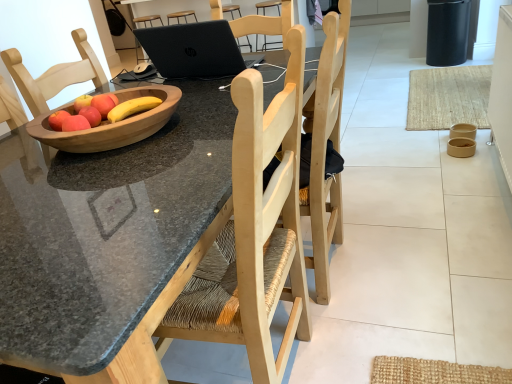
Question: From the image's perspective, is wooden bowl of fruit at center on wooden bowl at left, which is the first bowl in left-to-right order?

Choices:
 (A) no
 (B) yes

Answer: (B)

Question: Does wooden bowl of fruit at center have a greater height compared to wooden bowl at left, the 3th bowl from the back?

Choices:
 (A) no
 (B) yes

Answer: (A)

Question: From the image's perspective, does wooden bowl of fruit at center appear lower than wooden bowl at left, which is the first bowl in left-to-right order?

Choices:
 (A) yes
 (B) no

Answer: (B)

Question: Is the surface of wooden bowl of fruit at center in direct contact with wooden bowl at left, which is the third bowl from right to left?

Choices:
 (A) no
 (B) yes

Answer: (B)

Question: Is wooden bowl of fruit at center positioned in front of wooden bowl at left, which is the first bowl in left-to-right order?

Choices:
 (A) yes
 (B) no

Answer: (B)

Question: Considering the relative sizes of wooden bowl of fruit at center and wooden bowl at left, which is the third bowl from right to left, in the image provided, is wooden bowl of fruit at center smaller than wooden bowl at left, which is the third bowl from right to left,?

Choices:
 (A) yes
 (B) no

Answer: (A)

Question: Would you say wooden bowl at left, which is the first bowl in left-to-right order, is outside matte wood apple at center, which is the second apple in top-to-bottom order?

Choices:
 (A) no
 (B) yes

Answer: (B)

Question: Is wooden bowl at left, the 3th bowl from the back, aimed at matte wood apple at center, the 2th apple positioned from the back?

Choices:
 (A) yes
 (B) no

Answer: (B)

Question: Are wooden bowl at left, the 3th bowl from the back, and matte wood apple at center, which is the 1th apple in bottom-to-top order, beside each other?

Choices:
 (A) yes
 (B) no

Answer: (B)

Question: Does wooden bowl at left, which is the first bowl in left-to-right order, have a lesser height compared to matte wood apple at center, the 1th apple when ordered from front to back?

Choices:
 (A) yes
 (B) no

Answer: (B)

Question: Considering the relative positions of wooden bowl at left, marked as the 1th bowl in a front-to-back arrangement, and matte wood apple at center, the 1th apple when ordered from front to back, in the image provided, is wooden bowl at left, marked as the 1th bowl in a front-to-back arrangement, to the left of matte wood apple at center, the 1th apple when ordered from front to back, from the viewer's perspective?

Choices:
 (A) no
 (B) yes

Answer: (A)

Question: From the image's perspective, is brown paper bowl at lower right, which ranks as the 2th bowl in back-to-front order, above matte brown bowl at right, the 1th bowl viewed from the right?

Choices:
 (A) no
 (B) yes

Answer: (A)